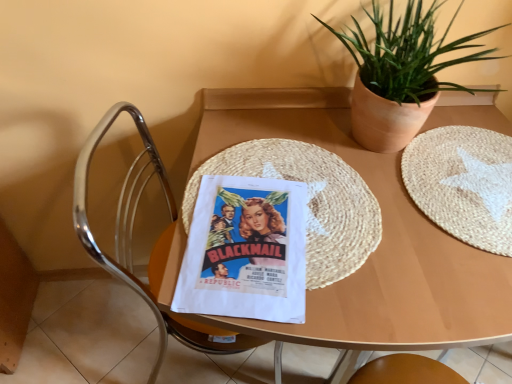
Question: Is the depth of wooden placemat at center greater than that of green leafy plant in clay pot at upper right?

Choices:
 (A) yes
 (B) no

Answer: (B)

Question: Is wooden placemat at center positioned before green leafy plant in clay pot at upper right?

Choices:
 (A) no
 (B) yes

Answer: (B)

Question: Is wooden placemat at center to the right of green leafy plant in clay pot at upper right from the viewer's perspective?

Choices:
 (A) no
 (B) yes

Answer: (A)

Question: Does wooden placemat at center have a lesser width compared to green leafy plant in clay pot at upper right?

Choices:
 (A) no
 (B) yes

Answer: (A)

Question: Is wooden placemat at center looking in the opposite direction of green leafy plant in clay pot at upper right?

Choices:
 (A) yes
 (B) no

Answer: (B)

Question: From the image's perspective, does wooden placemat at center appear lower than green leafy plant in clay pot at upper right?

Choices:
 (A) yes
 (B) no

Answer: (A)

Question: Can you confirm if white woven placemat at center right is shorter than green leafy plant in clay pot at upper right?

Choices:
 (A) yes
 (B) no

Answer: (A)

Question: Is white woven placemat at center right oriented towards green leafy plant in clay pot at upper right?

Choices:
 (A) yes
 (B) no

Answer: (B)

Question: From a real-world perspective, is white woven placemat at center right over green leafy plant in clay pot at upper right?

Choices:
 (A) yes
 (B) no

Answer: (B)

Question: Can you confirm if white woven placemat at center right is wider than green leafy plant in clay pot at upper right?

Choices:
 (A) no
 (B) yes

Answer: (B)

Question: Would you say white woven placemat at center right contains green leafy plant in clay pot at upper right?

Choices:
 (A) no
 (B) yes

Answer: (A)

Question: Would you say white woven placemat at center right is outside green leafy plant in clay pot at upper right?

Choices:
 (A) no
 (B) yes

Answer: (B)

Question: Is white woven placemat at center right to the right of polished chrome chair at left from the viewer's perspective?

Choices:
 (A) yes
 (B) no

Answer: (A)